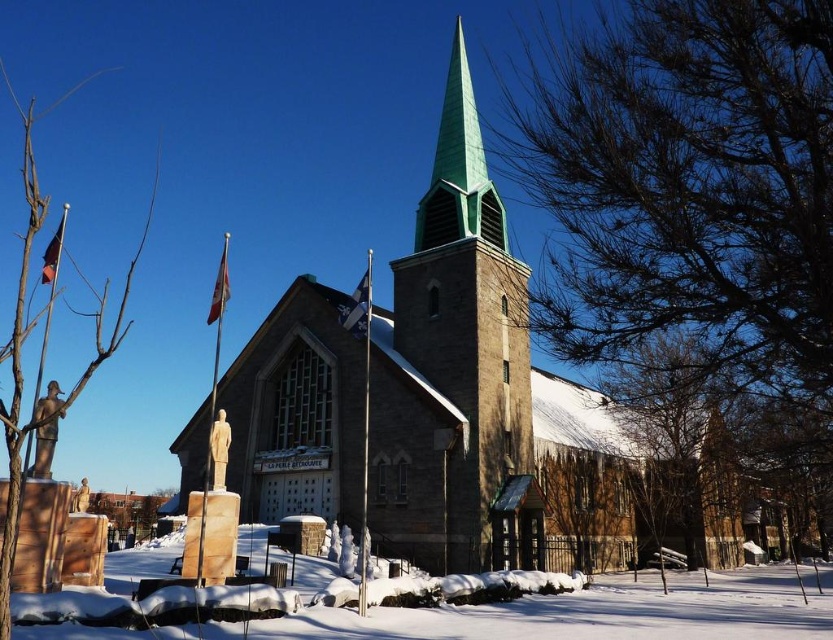
Question: Does brown textured tree at upper right appear over brown wood tree at left?

Choices:
 (A) no
 (B) yes

Answer: (A)

Question: Which point is closer to the camera?

Choices:
 (A) brown wood tree at left
 (B) white powdery snow at lower center

Answer: (A)

Question: Does white powdery snow at lower center have a lesser width compared to brown wood tree at left?

Choices:
 (A) yes
 (B) no

Answer: (A)

Question: Is brown textured tree at upper right thinner than brown wood tree at left?

Choices:
 (A) no
 (B) yes

Answer: (B)

Question: Which point is farther to the camera?

Choices:
 (A) (636, 192)
 (B) (408, 624)
 (C) (28, 156)

Answer: (C)

Question: Estimate the real-world distances between objects in this image. Which object is closer to the brown textured tree at upper right?

Choices:
 (A) brown wood tree at left
 (B) white powdery snow at lower center

Answer: (B)